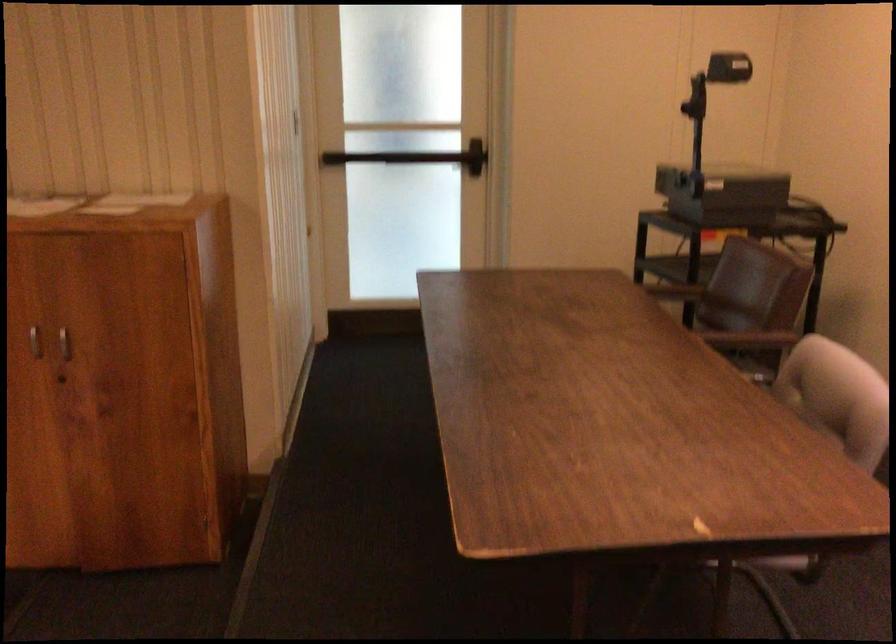
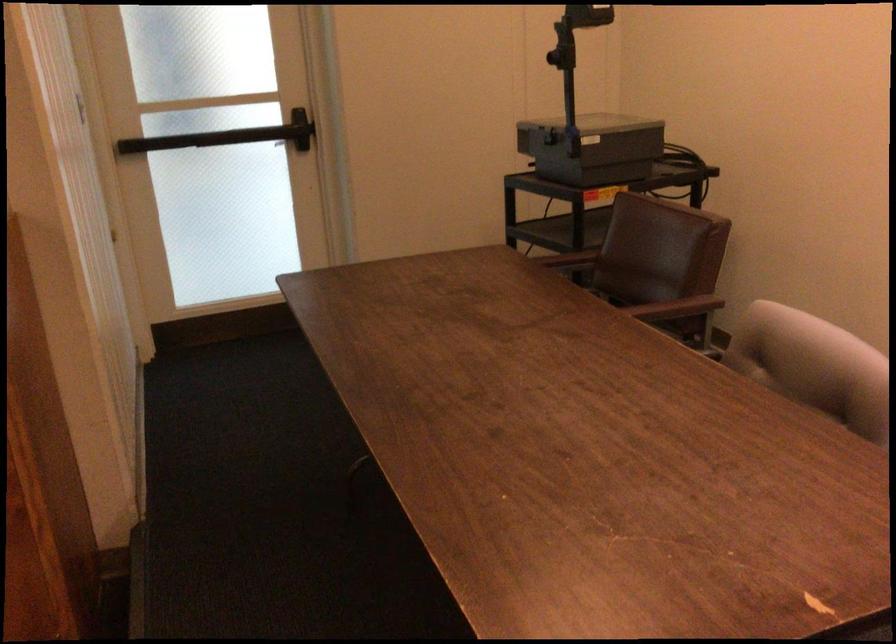
Find the pixel in the second image that matches [754,339] in the first image.

(677, 308)